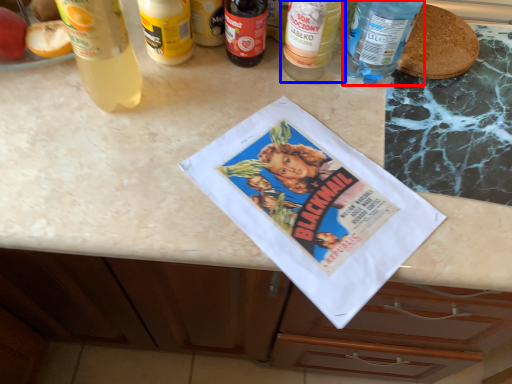
Question: Which object is further to the camera taking this photo, bottle (highlighted by a red box) or bottle (highlighted by a blue box)?

Choices:
 (A) bottle
 (B) bottle

Answer: (B)